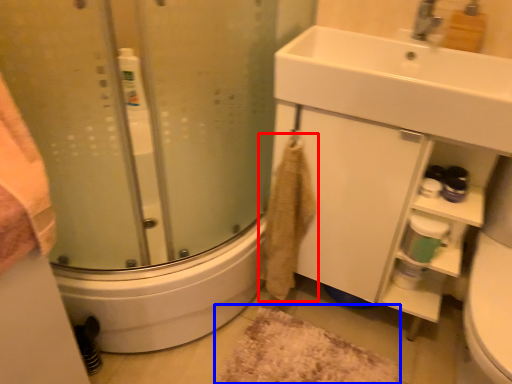
Question: Which object is closer to the camera taking this photo, bath towel (highlighted by a red box) or bath mat (highlighted by a blue box)?

Choices:
 (A) bath towel
 (B) bath mat

Answer: (A)